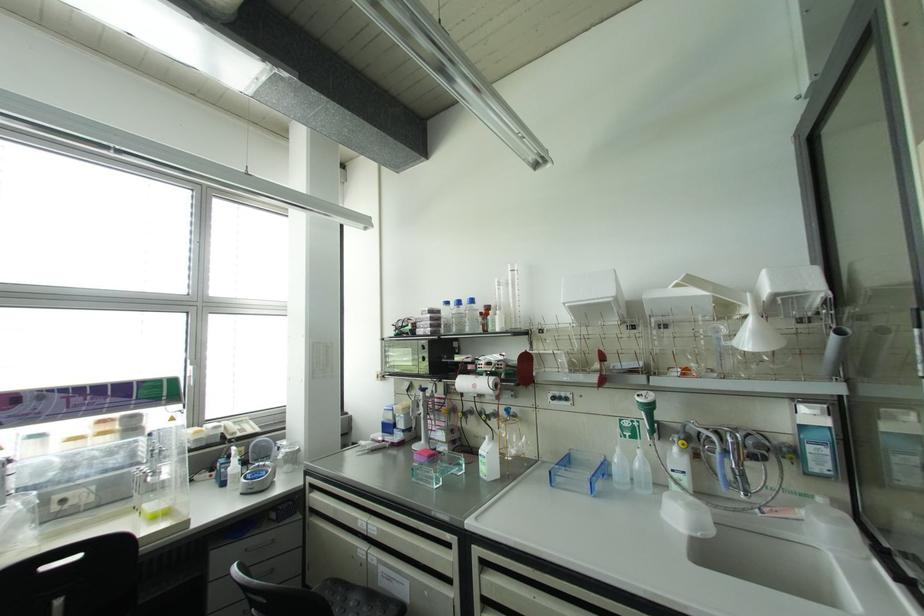
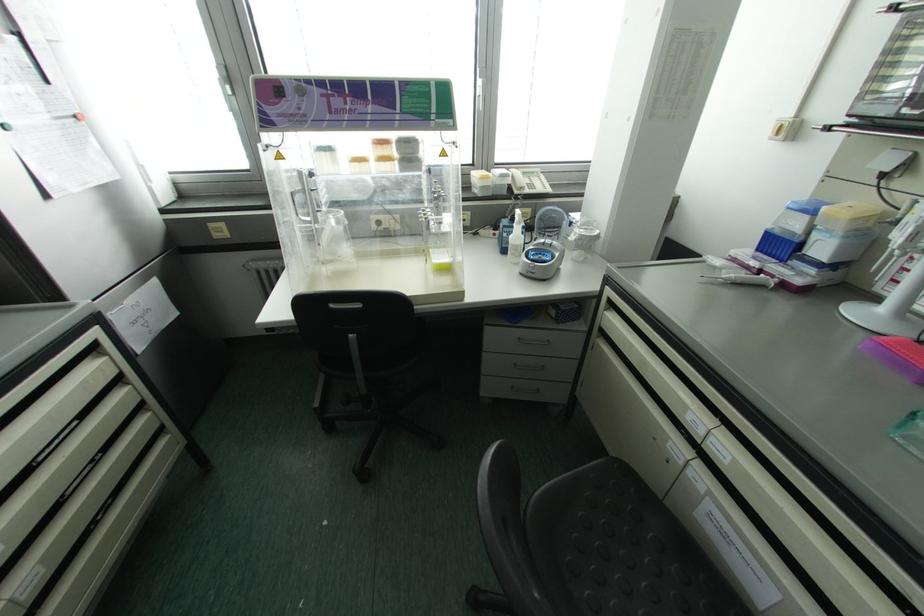
In the second image, find the point that corresponds to the point at 234,466 in the first image.

(516, 235)